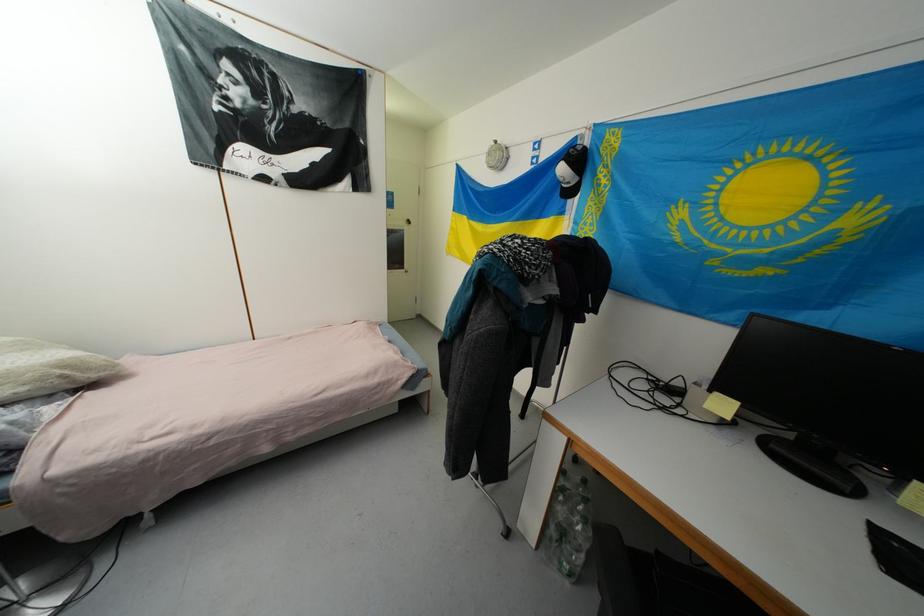
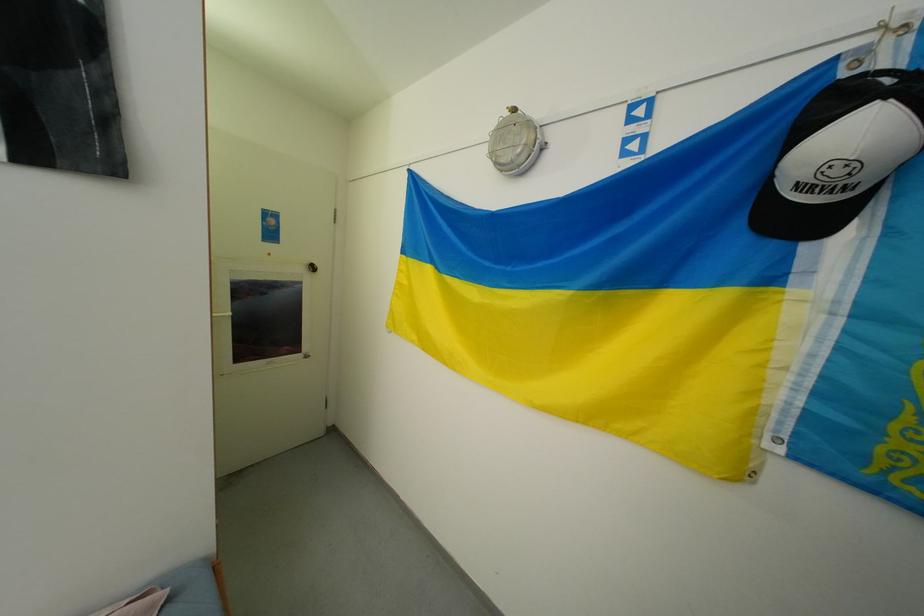
Where in the second image is the point corresponding to point 586,150 from the first image?

(896, 81)